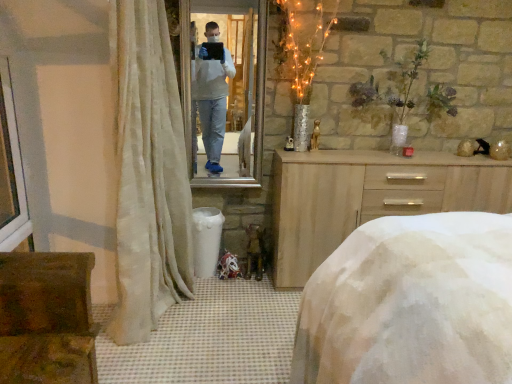
This screenshot has width=512, height=384. What do you see at coordinates (11, 172) in the screenshot?
I see `white plastic window frame at left` at bounding box center [11, 172].

What is the approximate height of white plastic window frame at left?

white plastic window frame at left is 32.20 inches in height.

This screenshot has width=512, height=384. What do you see at coordinates (411, 304) in the screenshot? I see `white textured bed at center` at bounding box center [411, 304].

The height and width of the screenshot is (384, 512). In order to click on white textured bed at center in this screenshot , I will do `click(411, 304)`.

Where is `light wood dresser at center`? The width and height of the screenshot is (512, 384). light wood dresser at center is located at coordinates (369, 197).

Describe the element at coordinates (206, 240) in the screenshot. I see `white plastic trash bin at lower center` at that location.

The width and height of the screenshot is (512, 384). Describe the element at coordinates (149, 176) in the screenshot. I see `sheer beige curtain at left` at that location.

What is the approximate width of metallic reflective mirror at center?

It is 2.16 inches.

Identify the location of white plastic window frame at left. (11, 172).

Is white plastic window frame at left placed right next to light wood dresser at center?

white plastic window frame at left and light wood dresser at center are not in contact.

Considering the relative sizes of white plastic window frame at left and light wood dresser at center in the image provided, is white plastic window frame at left thinner than light wood dresser at center?

Indeed, white plastic window frame at left has a lesser width compared to light wood dresser at center.

Is point (14, 156) in front of point (445, 169)?

Yes.

Is white plastic window frame at left turned away from light wood dresser at center?

No, white plastic window frame at left is not facing the opposite direction of light wood dresser at center.

Is light wood dresser at center far away from rustic wooden chest at lower left?

Yes.

From the picture: Who is smaller, light wood dresser at center or rustic wooden chest at lower left?

rustic wooden chest at lower left.

Is light wood dresser at center in front of rustic wooden chest at lower left?

No, the depth of light wood dresser at center is greater than that of rustic wooden chest at lower left.

Locate an element on the screen. The image size is (512, 384). chest of drawers that is on the right side of rustic wooden chest at lower left is located at coordinates pyautogui.click(x=369, y=197).

Is white textured bed at center facing away from white plastic window frame at left?

No.

Considering the positions of objects white textured bed at center and white plastic window frame at left in the image provided, who is more to the left, white textured bed at center or white plastic window frame at left?

Positioned to the left is white plastic window frame at left.

Can you confirm if white textured bed at center is smaller than white plastic window frame at left?

No, white textured bed at center is not smaller than white plastic window frame at left.

Does point (21, 282) appear closer or farther from the camera than point (286, 222)?

Clearly, point (21, 282) is closer to the camera than point (286, 222).

Is rustic wooden chest at lower left touching light wood dresser at center?

rustic wooden chest at lower left is not next to light wood dresser at center, and they're not touching.

Does rustic wooden chest at lower left come behind light wood dresser at center?

No, the depth of rustic wooden chest at lower left is less than that of light wood dresser at center.

Based on the photo, from a real-world perspective, between rustic wooden chest at lower left and light wood dresser at center, who is vertically lower?

In real-world perspective, rustic wooden chest at lower left is lower.

From a real-world perspective, does white textured bed at center sit lower than sheer beige curtain at left?

Yes, from a real-world perspective, white textured bed at center is beneath sheer beige curtain at left.

Between white textured bed at center and sheer beige curtain at left, which one has smaller width?

sheer beige curtain at left is thinner.

What's the angular difference between white textured bed at center and sheer beige curtain at left's facing directions?

They differ by 178 degrees in their facing directions.

Are white textured bed at center and sheer beige curtain at left making contact?

They are not placed beside each other.

Is metallic reflective mirror at center surrounding white plastic trash bin at lower center?

No, white plastic trash bin at lower center is not a part of metallic reflective mirror at center.

Is metallic reflective mirror at center positioned with its back to white plastic trash bin at lower center?

metallic reflective mirror at center is not turned away from white plastic trash bin at lower center.

Could you measure the distance between metallic reflective mirror at center and white plastic trash bin at lower center?

metallic reflective mirror at center is 69.19 centimeters from white plastic trash bin at lower center.

From a real-world perspective, between metallic reflective mirror at center and white plastic trash bin at lower center, who is vertically higher?

metallic reflective mirror at center.

In the scene shown: Is metallic reflective mirror at center to the right of sheer beige curtain at left from the viewer's perspective?

Correct, you'll find metallic reflective mirror at center to the right of sheer beige curtain at left.

From the image's perspective, is metallic reflective mirror at center above sheer beige curtain at left?

Indeed, from the image's perspective, metallic reflective mirror at center is shown above sheer beige curtain at left.

Can you tell me how much metallic reflective mirror at center and sheer beige curtain at left differ in facing direction?

88.4 degrees separate the facing orientations of metallic reflective mirror at center and sheer beige curtain at left.

From a real-world perspective, is metallic reflective mirror at center on sheer beige curtain at left?

Correct, in the physical world, metallic reflective mirror at center is higher than sheer beige curtain at left.

You are a GUI agent. You are given a task and a screenshot of the screen. Output one action in this format:
    pyautogui.click(x=<x>, y=<y>)
    Task: Click on the chest of drawers lying on the right of white plastic window frame at left
    
    Given the screenshot: What is the action you would take?
    pyautogui.click(x=369, y=197)

What are the coordinates of `furniture directly beneath the light wood dresser at center (from a real-world perspective)` in the screenshot? It's located at tap(46, 318).

When comparing their distances from metallic reflective mirror at center, does sheer beige curtain at left or white plastic trash bin at lower center seem closer?

Based on the image, sheer beige curtain at left appears to be nearer to metallic reflective mirror at center.

Estimate the real-world distances between objects in this image. Which object is further from light wood dresser at center, sheer beige curtain at left or white plastic window frame at left?

white plastic window frame at left is further to light wood dresser at center.

Estimate the real-world distances between objects in this image. Which object is further from light wood dresser at center, rustic wooden chest at lower left or white plastic trash bin at lower center?

The object further to light wood dresser at center is rustic wooden chest at lower left.

When comparing their distances from white plastic trash bin at lower center, does white textured bed at center or sheer beige curtain at left seem further?

Based on the image, white textured bed at center appears to be further to white plastic trash bin at lower center.

Looking at the image, which one is located closer to sheer beige curtain at left, white textured bed at center or white plastic window frame at left?

white plastic window frame at left lies closer to sheer beige curtain at left than the other object.

From the image, which object appears to be farther from white plastic window frame at left, rustic wooden chest at lower left or white plastic trash bin at lower center?

white plastic trash bin at lower center is further to white plastic window frame at left.

Based on their spatial positions, is white textured bed at center or white plastic trash bin at lower center closer to white plastic window frame at left?

white plastic trash bin at lower center.

From the image, which object appears to be nearer to light wood dresser at center, white textured bed at center or sheer beige curtain at left?

sheer beige curtain at left.

At what (x,y) coordinates should I click in order to perform the action: click on mirror between white plastic window frame at left and light wood dresser at center in the horizontal direction. Please return your answer as a coordinate pair (x, y). Looking at the image, I should click on (225, 80).

At what (x,y) coordinates should I click in order to perform the action: click on trash bin/can between sheer beige curtain at left and light wood dresser at center from left to right. Please return your answer as a coordinate pair (x, y). The height and width of the screenshot is (384, 512). Looking at the image, I should click on (206, 240).

What are the coordinates of `window frame positioned between white textured bed at center and white plastic trash bin at lower center from near to far` in the screenshot? It's located at (11, 172).

Find the location of a particular element. The width and height of the screenshot is (512, 384). mirror between sheer beige curtain at left and white plastic trash bin at lower center along the z-axis is located at coordinates (225, 80).